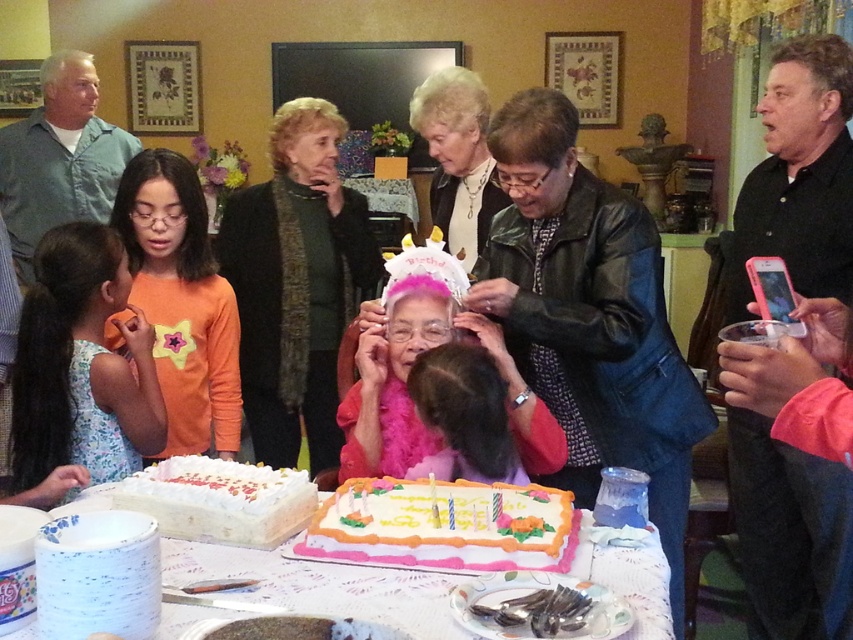
You are standing at the point labeled as point (190, 484) and want to move to the point labeled as point (186, 365). According to the scene, which direction should you move to reach your destination?

You should move backward to reach point (186, 365) because it is behind point (190, 484).

You are a guest at the birthday party and want to place a napkin on the table. You have a white paper plate at lower center and a pink feather boa at center. Which object should you use to place the napkin, and why?

The white paper plate at lower center should be used to place the napkin because it is positioned on the left side of the pink feather boa at center, making it more accessible for placing items like napkins.